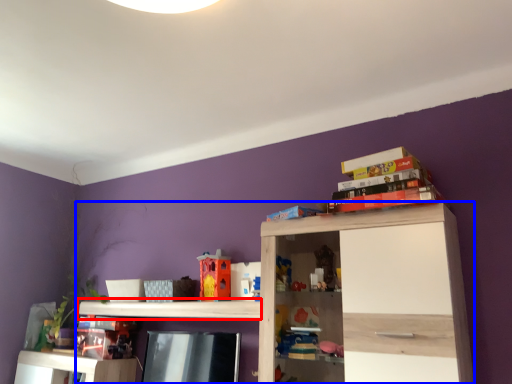
Question: Which object appears closest to the camera in this image, shelf (highlighted by a red box) or shelf (highlighted by a blue box)?

Choices:
 (A) shelf
 (B) shelf

Answer: (B)